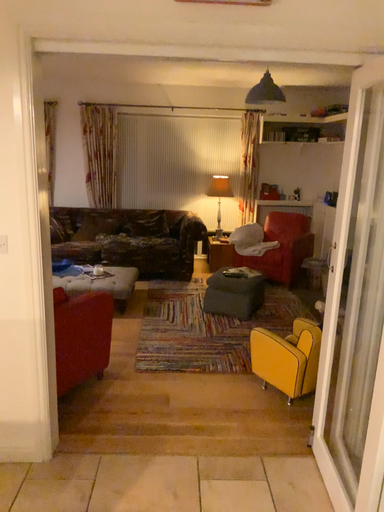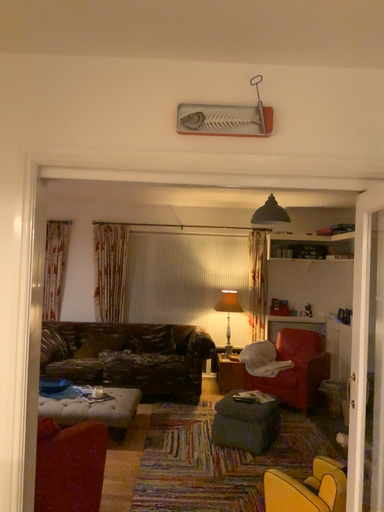
Question: Which way did the camera rotate in the video?

Choices:
 (A) rotated downward
 (B) rotated upward

Answer: (B)